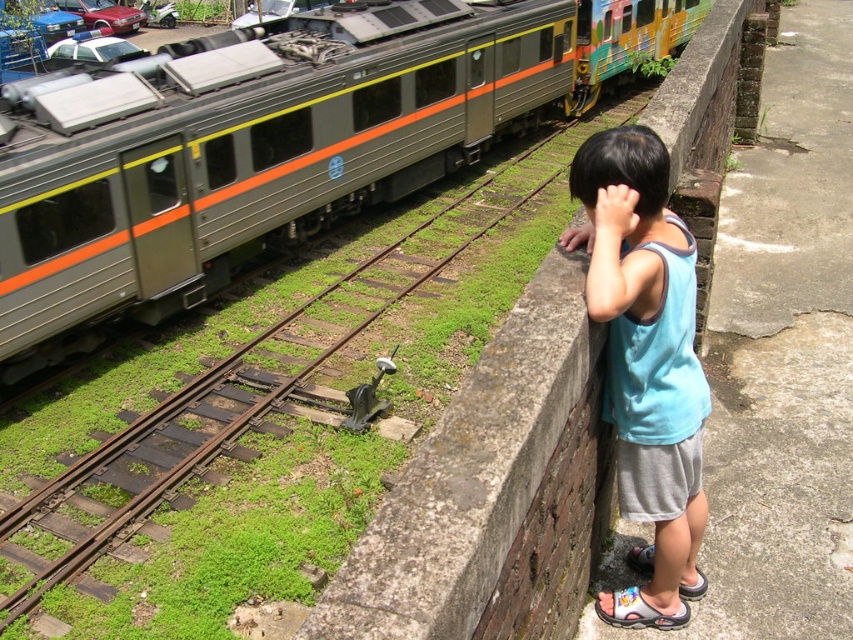
You are a photographer trying to capture a photo of the metallic gray train at upper left and the blue cotton tank top at upper right in the same frame. Which object should you position closer to the camera to ensure both fit in the frame?

Since the metallic gray train at upper left is wider than the blue cotton tank top at upper right, you should position the blue cotton tank top at upper right closer to the camera to ensure both fit in the frame.